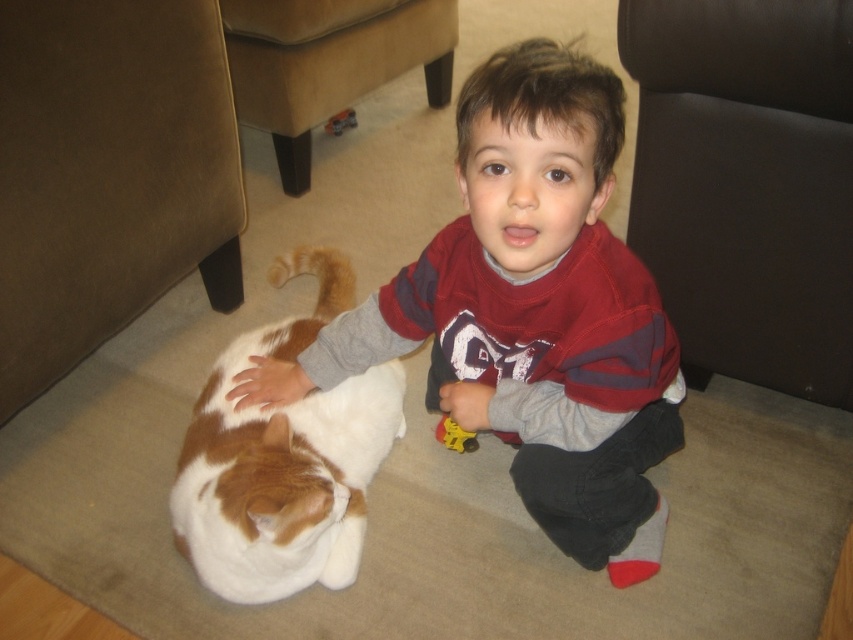
Can you confirm if white soft fur cat at lower left is positioned below orange fur tail at lower left?

Yes, white soft fur cat at lower left is below orange fur tail at lower left.

What are the coordinates of `white soft fur cat at lower left` in the screenshot? It's located at (283, 458).

Does brown leather armchair at lower center appear on the right side of orange fur tail at lower left?

Correct, you'll find brown leather armchair at lower center to the right of orange fur tail at lower left.

Is point (306, 116) positioned behind point (345, 289)?

Yes, point (306, 116) is behind point (345, 289).

Is point (355, 8) positioned before point (323, 284)?

No.

Locate an element on the screen. This screenshot has height=640, width=853. brown leather armchair at lower center is located at coordinates (328, 61).

Between point (445, 332) and point (473, 451), which one is positioned behind?

The point (473, 451) is more distant.

Can you confirm if matte red sweatshirt at center is positioned above yellow plastic toy at center?

Yes.

Who is more forward, (556,131) or (437,422)?

Positioned in front is point (556,131).

Where is `matte red sweatshirt at center`? This screenshot has height=640, width=853. matte red sweatshirt at center is located at coordinates (531, 312).